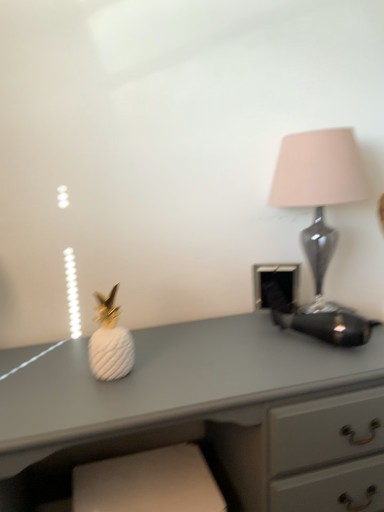
This screenshot has width=384, height=512. What are the coordinates of `free space behind white matte pineapple at center` in the screenshot? It's located at (131, 344).